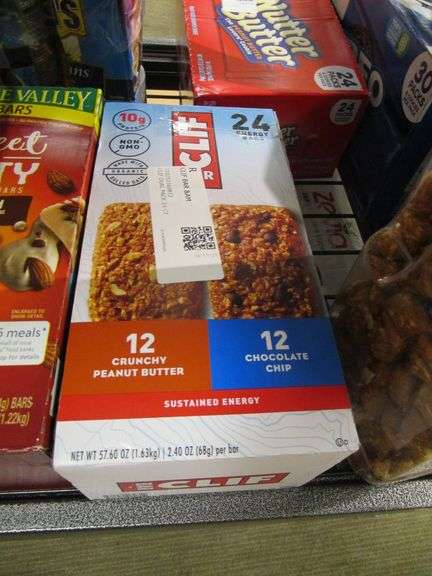
I want to click on shelf, so click(344, 214).